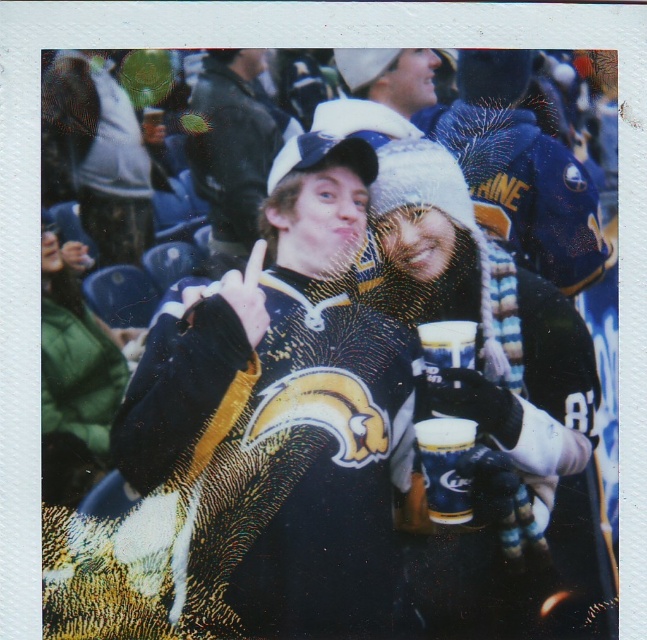
Question: Which object is closer to the camera taking this photo?

Choices:
 (A) matte black jacket at center
 (B) gold metallic cup at center

Answer: (B)

Question: Which point is closer to the camera?

Choices:
 (A) matte black jacket at center
 (B) gold metallic cup at center

Answer: (B)

Question: Is matte black jacket at center wider than gold metallic cup at center?

Choices:
 (A) no
 (B) yes

Answer: (B)

Question: Does matte black jacket at center come behind gold metallic cup at center?

Choices:
 (A) no
 (B) yes

Answer: (B)

Question: In this image, where is matte black jacket at center located relative to gold metallic cup at center?

Choices:
 (A) below
 (B) above

Answer: (B)